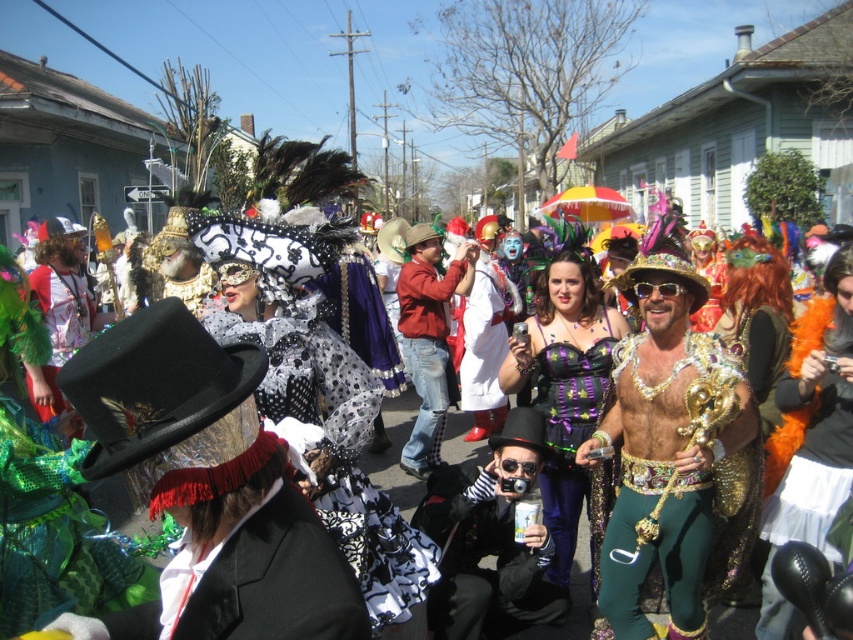
Question: Observing the image, what is the correct spatial positioning of shiny black top hat at center in reference to sparkly gold dress at center?

Choices:
 (A) left
 (B) right

Answer: (A)

Question: Is black velvet top hat at center closer to the viewer compared to gold sequined hat at center?

Choices:
 (A) yes
 (B) no

Answer: (A)

Question: Which point is farther to the camera?

Choices:
 (A) (502, 552)
 (B) (798, 352)
 (C) (576, 401)
 (D) (635, 385)

Answer: (A)

Question: Which of the following is the closest to the observer?

Choices:
 (A) (163, 420)
 (B) (842, 301)
 (C) (442, 362)
 (D) (495, 620)

Answer: (A)

Question: Does black velvet top hat at center have a lesser width compared to orange feather boa at center?

Choices:
 (A) yes
 (B) no

Answer: (B)

Question: Which of the following is the farthest from the observer?

Choices:
 (A) gold sequined hat at center
 (B) purple sequined corset at center
 (C) orange feather boa at center
 (D) sparkly gold dress at center

Answer: (B)